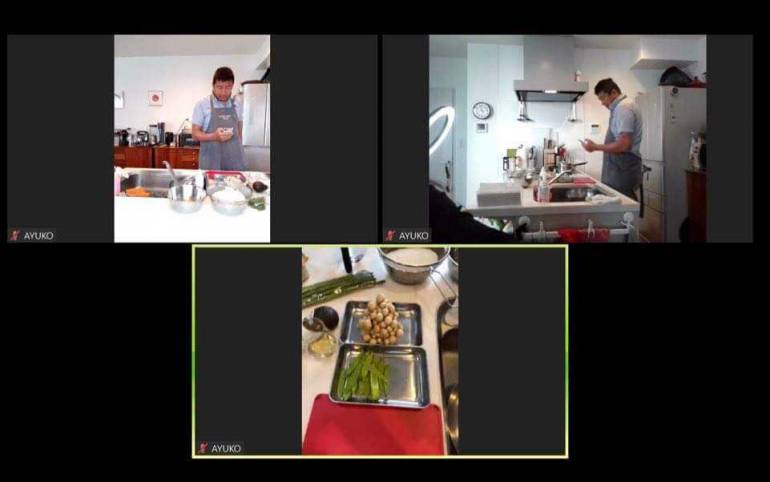
This screenshot has height=482, width=770. In order to click on kitchen hood in this screenshot , I will do `click(543, 80)`.